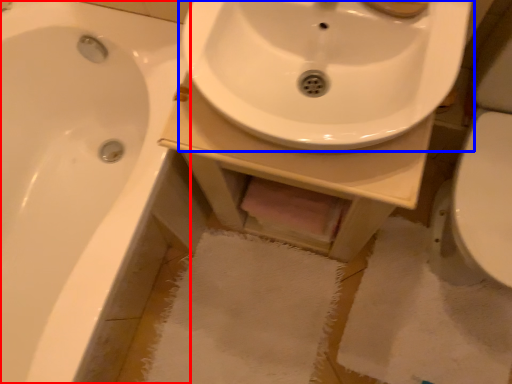
Question: Which object is closer to the camera taking this photo, bathtub (highlighted by a red box) or sink (highlighted by a blue box)?

Choices:
 (A) bathtub
 (B) sink

Answer: (B)